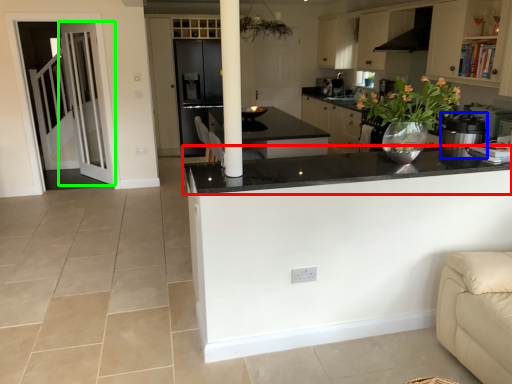
Question: Which object is the farthest from countertop (highlighted by a red box)? Choose among these: kitchen appliance (highlighted by a blue box) or door (highlighted by a green box).

Choices:
 (A) kitchen appliance
 (B) door

Answer: (B)